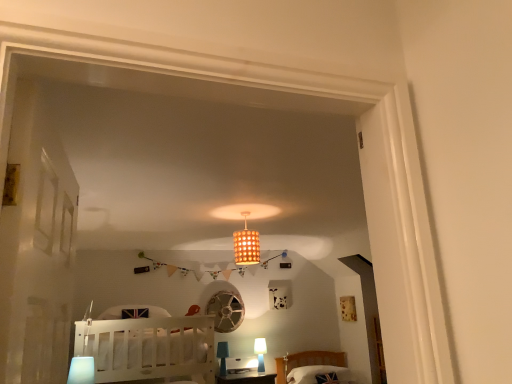
Question: From the image's perspective, is blue glass lamp at lower center, the third lamp when ordered from front to back, beneath white fabric pillow at lower right?

Choices:
 (A) no
 (B) yes

Answer: (A)

Question: Is blue glass lamp at lower center, marked as the 2th lamp in a back-to-front arrangement, thinner than white fabric pillow at lower right?

Choices:
 (A) yes
 (B) no

Answer: (A)

Question: Is white fabric pillow at lower right at the back of blue glass lamp at lower center, which appears as the second lamp when ordered from the bottom?

Choices:
 (A) yes
 (B) no

Answer: (B)

Question: Is blue glass lamp at lower center, marked as the 2th lamp in a back-to-front arrangement, smaller than white fabric pillow at lower right?

Choices:
 (A) no
 (B) yes

Answer: (B)

Question: Does blue glass lamp at lower center, the second lamp from the left, have a greater height compared to white fabric pillow at lower right?

Choices:
 (A) yes
 (B) no

Answer: (A)

Question: Considering the relative positions of blue glass lamp at lower center, the third lamp when ordered from front to back, and white fabric pillow at lower right in the image provided, is blue glass lamp at lower center, the third lamp when ordered from front to back, to the right of white fabric pillow at lower right from the viewer's perspective?

Choices:
 (A) no
 (B) yes

Answer: (A)

Question: Is the position of matte white lamp at lower center, the first lamp in the right-to-left sequence, less distant than that of white wood crib at lower left?

Choices:
 (A) no
 (B) yes

Answer: (A)

Question: Is matte white lamp at lower center, placed as the 1th lamp when sorted from back to front, far from white wood crib at lower left?

Choices:
 (A) yes
 (B) no

Answer: (A)

Question: Is matte white lamp at lower center, marked as the fourth lamp in a left-to-right arrangement, positioned behind white wood crib at lower left?

Choices:
 (A) no
 (B) yes

Answer: (B)

Question: From a real-world perspective, is matte white lamp at lower center, marked as the fourth lamp in a left-to-right arrangement, beneath white wood crib at lower left?

Choices:
 (A) no
 (B) yes

Answer: (B)

Question: Can you confirm if matte white lamp at lower center, placed as the 1th lamp when sorted from back to front, is positioned to the left of white wood crib at lower left?

Choices:
 (A) yes
 (B) no

Answer: (B)

Question: Can you confirm if matte white lamp at lower center, placed as the 1th lamp when sorted from back to front, is taller than white wood crib at lower left?

Choices:
 (A) no
 (B) yes

Answer: (A)

Question: Can you confirm if white wood crib at lower left is taller than white fabric pillow at lower right?

Choices:
 (A) no
 (B) yes

Answer: (B)